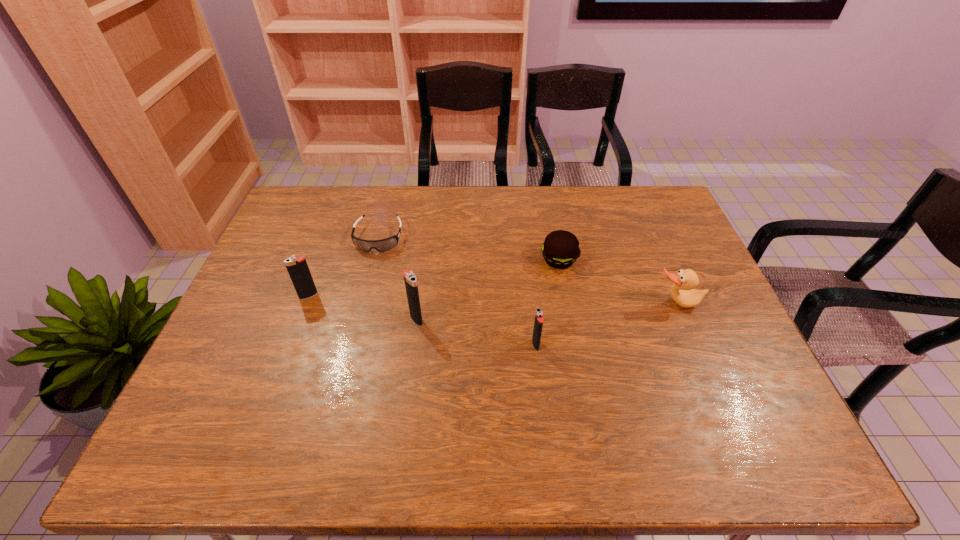
Please point out where to position a new igniter on the right to maintain spacing. Please provide its 2D coordinates. Your answer should be formatted as a tuple, i.e. [(x, y)], where the tuple contains the x and y coordinates of a point satisfying the conditions above.

[(668, 373)]